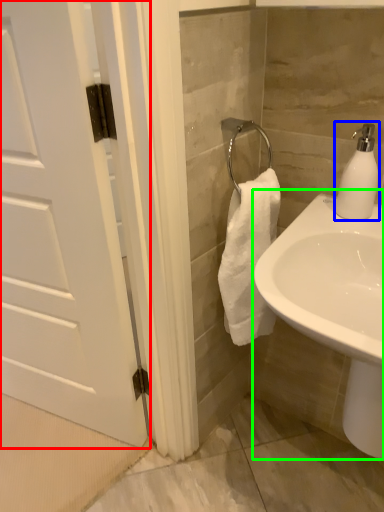
Question: Which is nearer to the door (highlighted by a red box)? soap dispenser (highlighted by a blue box) or sink (highlighted by a green box).

Choices:
 (A) soap dispenser
 (B) sink

Answer: (B)